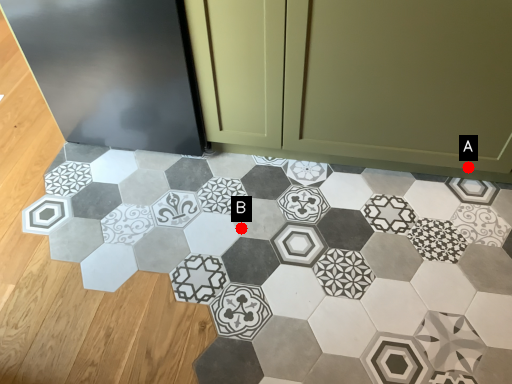
Question: Two points are circled on the image, labeled by A and B beside each circle. Among these points, which one is farthest from the camera?

Choices:
 (A) A is further
 (B) B is further

Answer: (B)